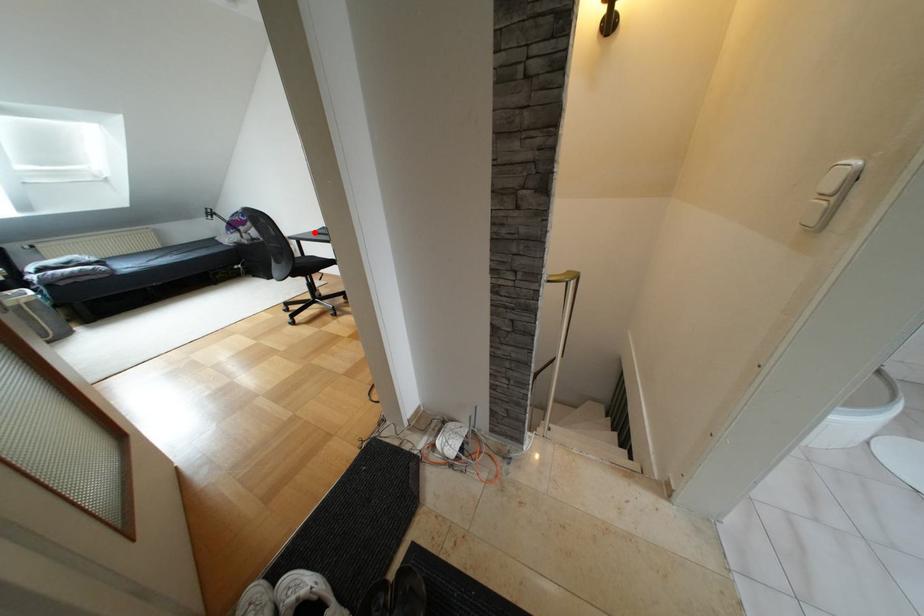
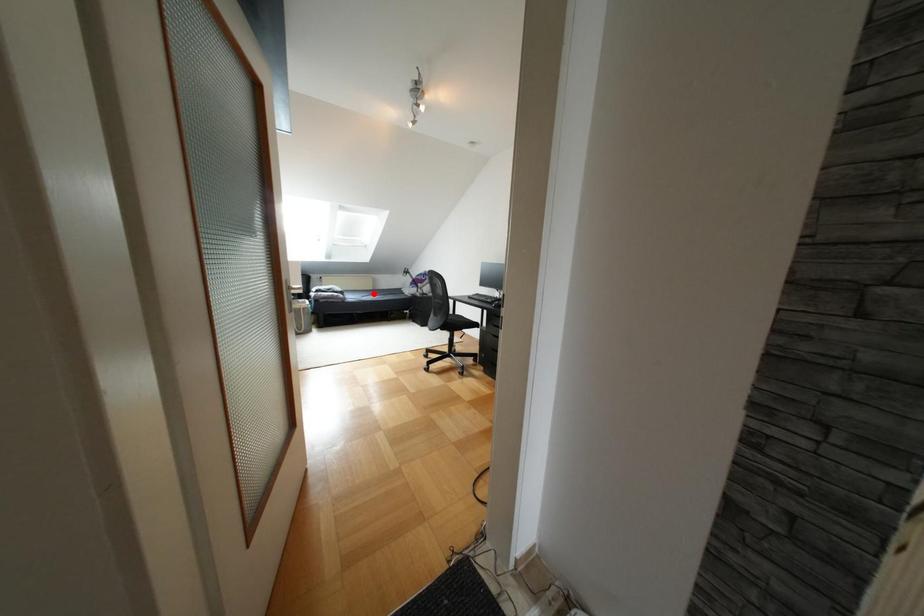
I am providing you with two images of the same scene from different viewpoints. A red point is marked on the first image and another point is marked on the second image. Does the point marked in image1 correspond to the same location as the one in image2?

No